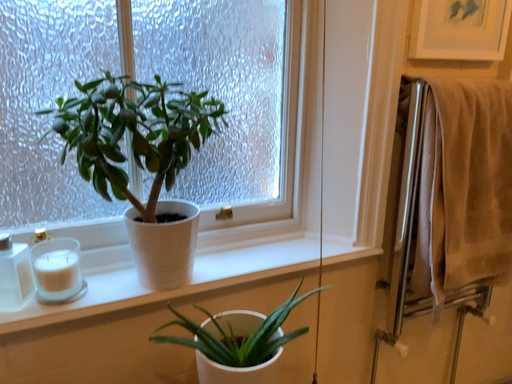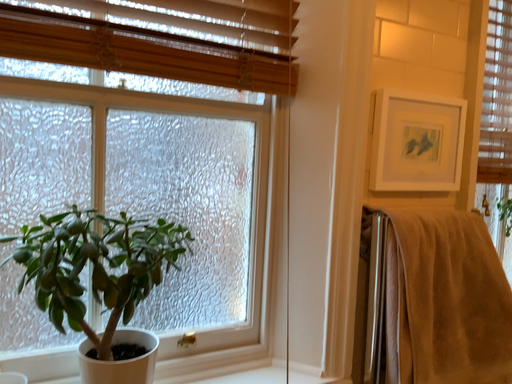
Question: How did the camera likely rotate when shooting the video?

Choices:
 (A) rotated upward
 (B) rotated downward

Answer: (A)